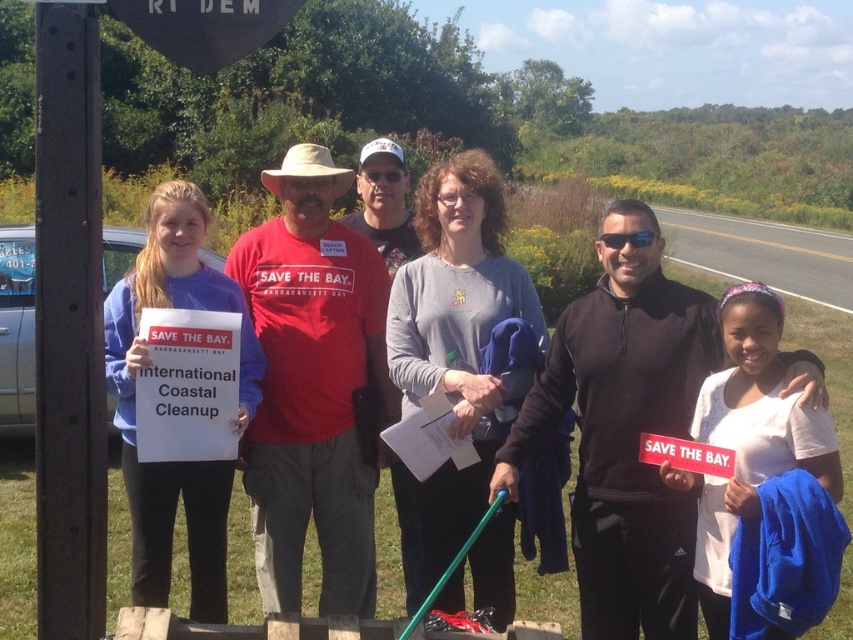
Question: Does matte red t-shirt at center have a greater width compared to black matte jacket at center?

Choices:
 (A) no
 (B) yes

Answer: (B)

Question: Does matte red t-shirt at center lie behind black matte jacket at center?

Choices:
 (A) yes
 (B) no

Answer: (A)

Question: Can you confirm if black matte jacket at center is thinner than gray cotton shirt at center?

Choices:
 (A) no
 (B) yes

Answer: (A)

Question: Estimate the real-world distances between objects in this image. Which object is farther from the gray cotton shirt at center?

Choices:
 (A) black matte jacket at center
 (B) matte red t-shirt at center
 (C) white paper sign at center

Answer: (C)

Question: Which point is farther to the camera?

Choices:
 (A) gray cotton shirt at center
 (B) black matte jacket at center
 (C) matte red t-shirt at center

Answer: (C)

Question: Based on their relative distances, which object is nearer to the matte red t-shirt at center?

Choices:
 (A) white paper sign at center
 (B) gray cotton shirt at center

Answer: (A)